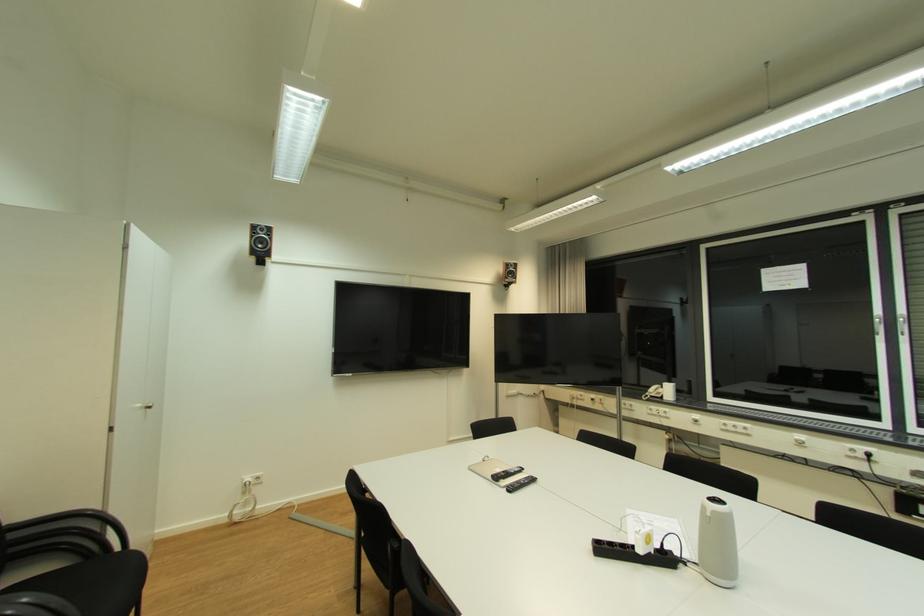
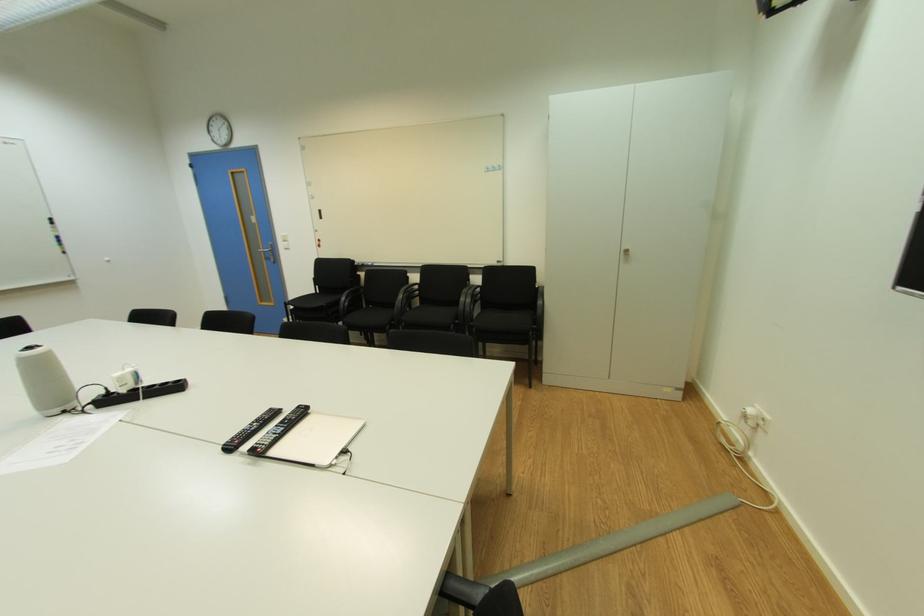
Find the pixel in the second image that matches the point at 149,411 in the first image.

(628, 254)